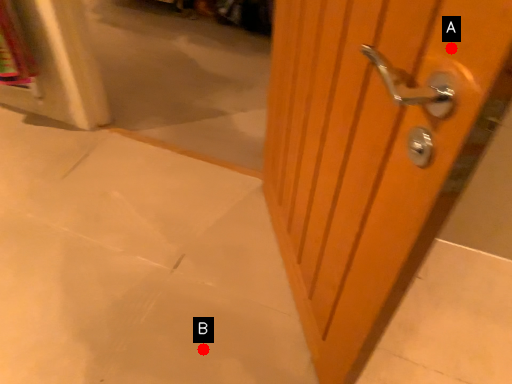
Question: Two points are circled on the image, labeled by A and B beside each circle. Which point is farther from the camera taking this photo?

Choices:
 (A) A is further
 (B) B is further

Answer: (B)